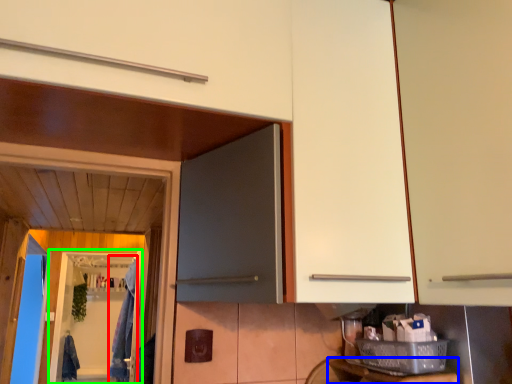
Question: Which is nearer to the laundry (highlighted by a red box)? counter top (highlighted by a blue box) or screen door (highlighted by a green box).

Choices:
 (A) counter top
 (B) screen door

Answer: (B)